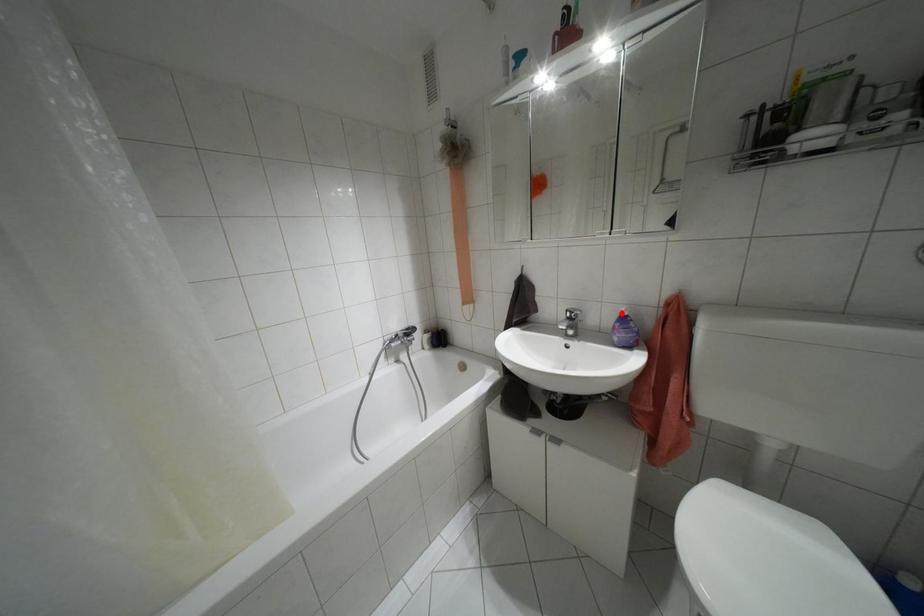
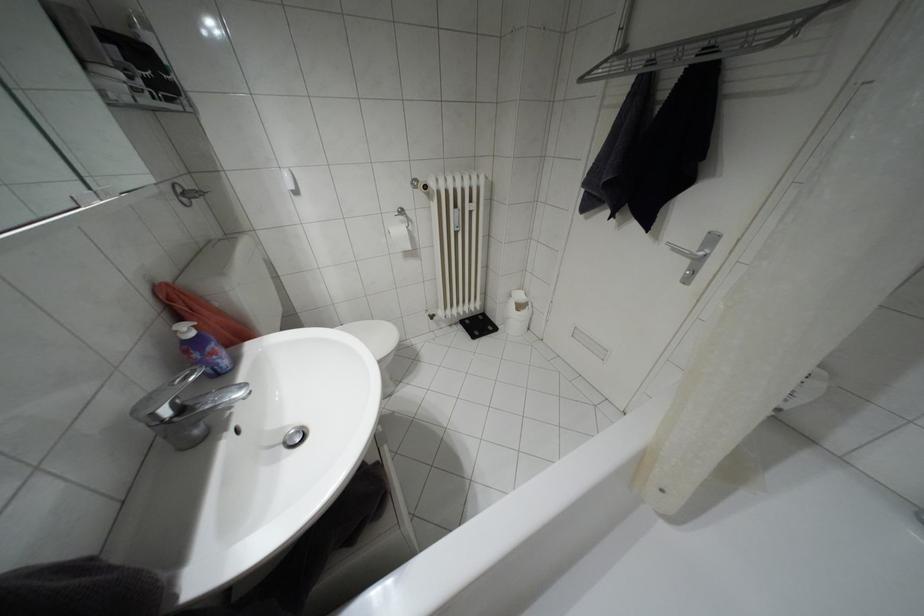
The point at the highlighted location is marked in the first image. Where is the corresponding point in the second image?

(190, 333)